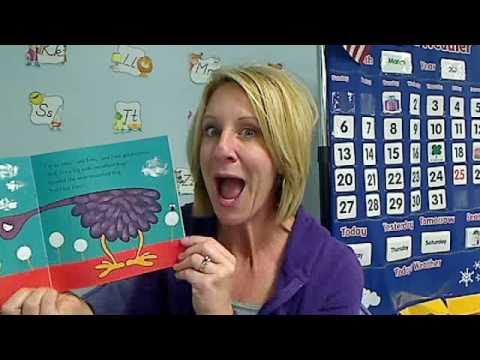
Locate an element on the screen. The image size is (480, 360). pale blue bulletin board is located at coordinates (162, 104).